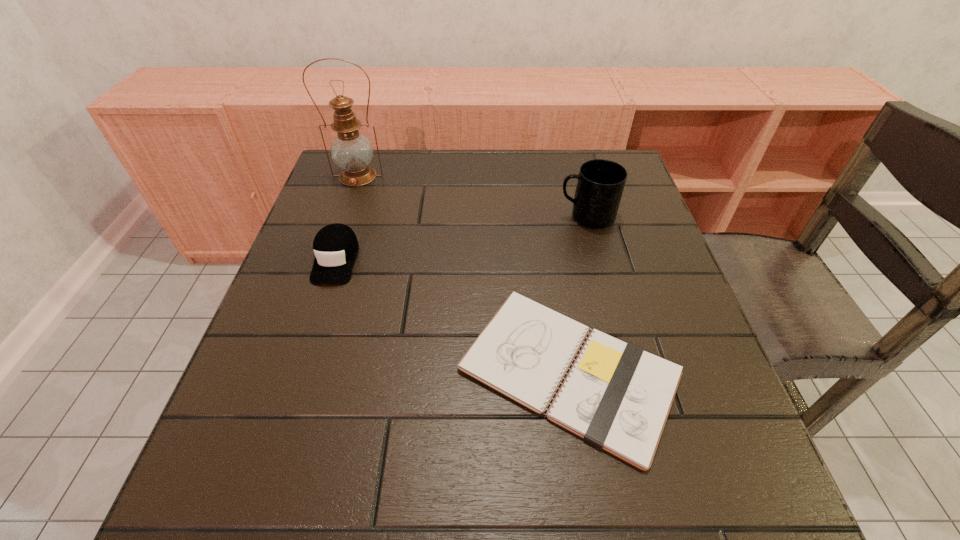
This screenshot has width=960, height=540. Identify the location of the tallest object. (351, 151).

Locate an element on the screen. The height and width of the screenshot is (540, 960). the farthest object is located at coordinates 351,151.

This screenshot has height=540, width=960. Identify the location of mug. (601, 182).

Locate an element on the screen. the second tallest object is located at coordinates (601, 182).

Identify the location of the third tallest object. This screenshot has width=960, height=540. (335, 246).

Image resolution: width=960 pixels, height=540 pixels. Identify the location of cap. (335, 246).

Where is `the shortest object`? the shortest object is located at coordinates (616, 396).

The height and width of the screenshot is (540, 960). In order to click on the nearest object in this screenshot , I will do `click(616, 396)`.

Identify the location of free point located on the back of the tallest object. Image resolution: width=960 pixels, height=540 pixels. (365, 156).

The width and height of the screenshot is (960, 540). I want to click on free region located 0.110m on the side of the third shortest object with the handle, so click(514, 217).